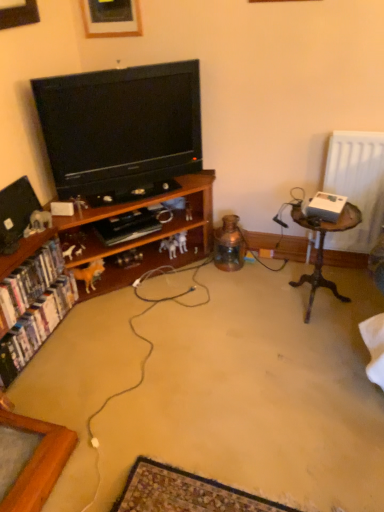
Question: From the image's perspective, relative to black glossy television at center, which ranks as the 1th television in right-to-left order, is wooden picture frame at upper center above or below?

Choices:
 (A) above
 (B) below

Answer: (A)

Question: In the image, is wooden picture frame at upper center positioned in front of or behind black glossy television at center, which ranks as the 1th television in right-to-left order?

Choices:
 (A) front
 (B) behind

Answer: (B)

Question: Based on their relative distances, which object is nearer to the woodenobject at right?

Choices:
 (A) wooden cabinet at left
 (B) wooden picture frame at upper center
 (C) white glossy bookshelf at left, the 1th book from the top
 (D) matte black television at left, positioned as the 1th television in left-to-right order
 (E) white glossy bookshelf at lower left, which is the second book in top-to-bottom order

Answer: (A)

Question: Estimate the real-world distances between objects in this image. Which object is farther from the wooden cabinet at left?

Choices:
 (A) matte black television at left, positioned as the 1th television in left-to-right order
 (B) wooden picture frame at upper center
 (C) white glossy bookshelf at lower left, the first book in the bottom-to-top sequence
 (D) white glossy bookshelf at left, acting as the second book starting from the bottom
 (E) black glossy television at center, which ranks as the 1th television in right-to-left order

Answer: (B)